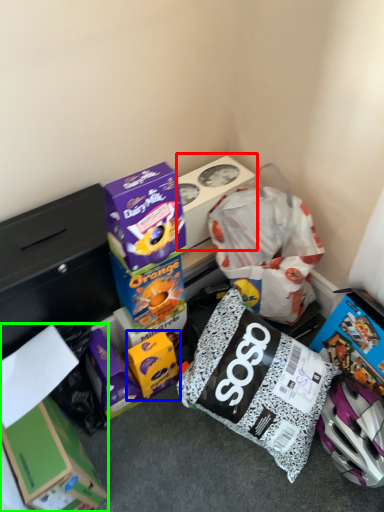
Question: Which object is the closest to the box (highlighted by a red box)? Choose among these: box (highlighted by a blue box) or box (highlighted by a green box).

Choices:
 (A) box
 (B) box

Answer: (A)